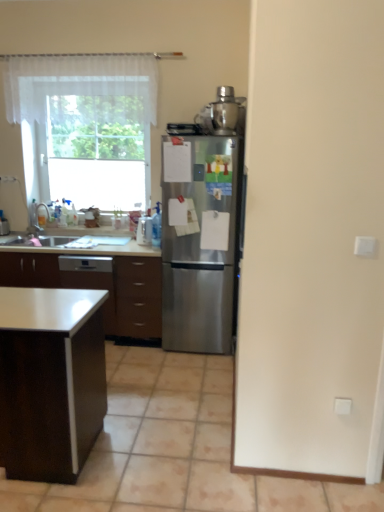
The height and width of the screenshot is (512, 384). I want to click on blank space situated above satin white dishwasher at lower left (from a real-world perspective), so click(x=100, y=241).